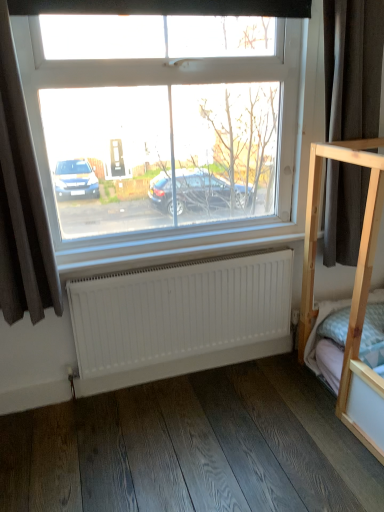
Question: In terms of width, does white matte radiator at lower center look wider or thinner when compared to brown fabric curtain at left, the 2th curtain viewed from the right?

Choices:
 (A) wide
 (B) thin

Answer: (B)

Question: In terms of height, does white matte radiator at lower center look taller or shorter compared to brown fabric curtain at left, the 2th curtain viewed from the right?

Choices:
 (A) tall
 (B) short

Answer: (B)

Question: Considering the real-world distances, which object is closest to the brown fabric curtain at left, the 2th curtain viewed from the right?

Choices:
 (A) white matte radiator at lower center
 (B) dark gray fabric at right, which is the 2th curtain in left-to-right order
 (C) dark wood flooring at lower center

Answer: (A)

Question: Which is farther from the dark gray fabric at right, which is the 2th curtain in left-to-right order?

Choices:
 (A) white matte radiator at lower center
 (B) dark wood flooring at lower center
 (C) brown fabric curtain at left, the 2th curtain viewed from the right

Answer: (C)